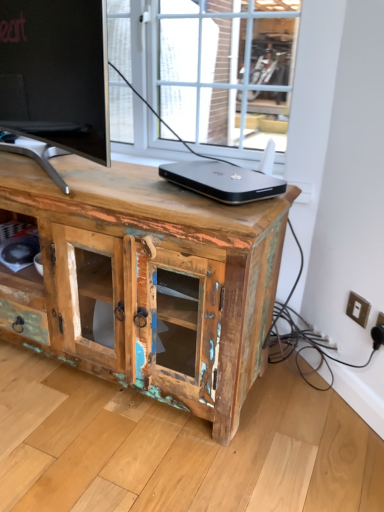
Question: Is white plastic electric outlet at lower right, positioned as the first electric outlet in right-to-left order, spatially inside white plastic switch at lower right, the second electric outlet when ordered from right to left, or outside of it?

Choices:
 (A) outside
 (B) inside

Answer: (A)

Question: Considering the positions of white plastic electric outlet at lower right, positioned as the 2th electric outlet in left-to-right order, and white plastic switch at lower right, positioned as the first electric outlet in left-to-right order, in the image, is white plastic electric outlet at lower right, positioned as the 2th electric outlet in left-to-right order, taller or shorter than white plastic switch at lower right, positioned as the first electric outlet in left-to-right order,?

Choices:
 (A) tall
 (B) short

Answer: (A)

Question: Which object is positioned closest to the weathered wood cabinet at center?

Choices:
 (A) white plastic switch at lower right, placed as the 2th electric outlet when sorted from front to back
 (B) sleek silver laptop at center
 (C) white plastic electric outlet at lower right, which ranks as the 1th electric outlet in front-to-back order

Answer: (B)

Question: Estimate the real-world distances between objects in this image. Which object is closer to the weathered wood cabinet at center?

Choices:
 (A) white plastic switch at lower right, positioned as the first electric outlet in left-to-right order
 (B) sleek silver laptop at center
 (C) white plastic electric outlet at lower right, which is counted as the second electric outlet, starting from the back

Answer: (B)